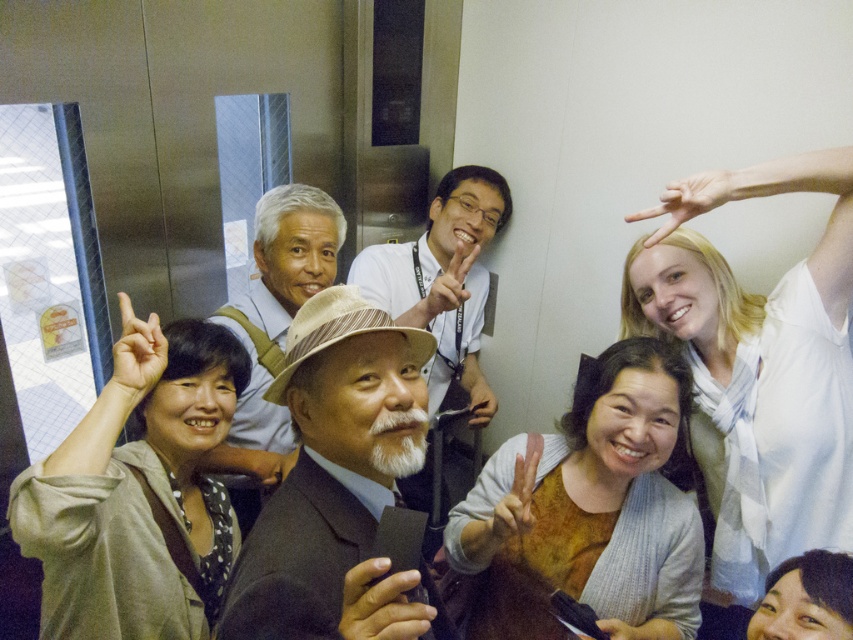
Question: Which point appears closest to the camera in this image?

Choices:
 (A) (734, 448)
 (B) (364, 509)
 (C) (251, 348)

Answer: (B)

Question: Which object appears farthest from the camera in this image?

Choices:
 (A) light brown textured hat at center
 (B) white beard at center
 (C) light brown fabric hat at center
 (D) white cotton shirt at upper right

Answer: (B)

Question: Is white cotton shirt at upper right to the left of light brown textured hat at center from the viewer's perspective?

Choices:
 (A) yes
 (B) no

Answer: (B)

Question: Which is nearer to the light brown textured hat at center?

Choices:
 (A) white beard at center
 (B) light brown fabric hat at center

Answer: (A)

Question: Is light brown fabric hat at center wider than light brown textured hat at center?

Choices:
 (A) yes
 (B) no

Answer: (B)

Question: Can you confirm if white cotton shirt at upper right is positioned to the right of white beard at center?

Choices:
 (A) yes
 (B) no

Answer: (A)